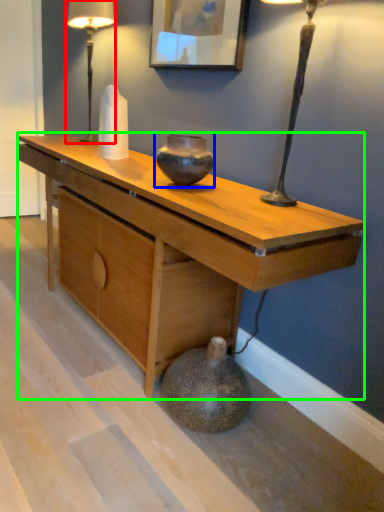
Question: Which object is the closest to the table lamp (highlighted by a red box)? Choose among these: vase (highlighted by a blue box) or desk (highlighted by a green box).

Choices:
 (A) vase
 (B) desk

Answer: (B)